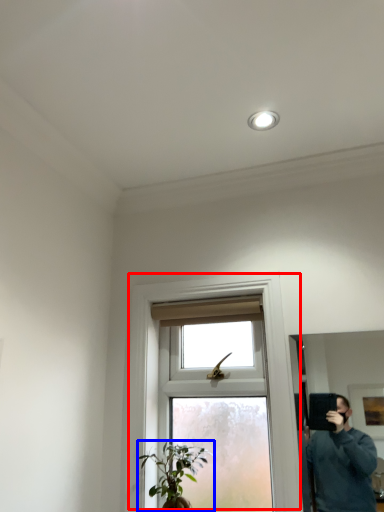
Question: Which of the following is the closest to the observer, window (highlighted by a red box) or houseplant (highlighted by a blue box)?

Choices:
 (A) window
 (B) houseplant

Answer: (A)